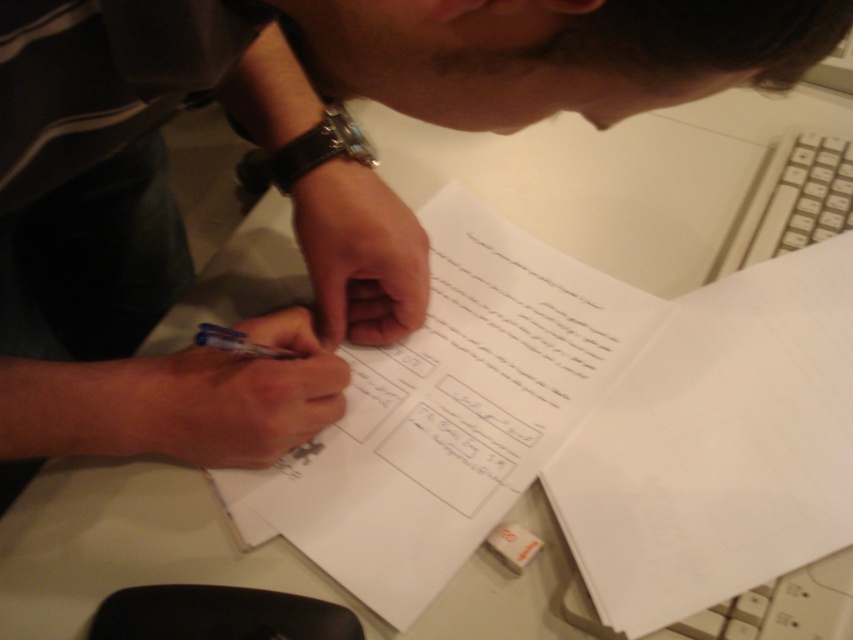
Measure the distance between point [267,451] and camera.

Point [267,451] and camera are 51.11 centimeters apart.

Based on the photo, measure the distance between point (134,212) and camera.

A distance of 30.78 inches exists between point (134,212) and camera.

Find the location of a particular element. This screenshot has width=853, height=640. matte black pen at center is located at coordinates (287, 180).

Between point (845, 156) and point (231, 332), which one is positioned in front?

Positioned in front is point (231, 332).

The height and width of the screenshot is (640, 853). Find the location of `white plastic keyboard at upper right`. white plastic keyboard at upper right is located at coordinates (791, 202).

Who is positioned more to the right, matte black pen at center or white plastic keyboard at upper right?

white plastic keyboard at upper right

Which is above, matte black pen at center or white plastic keyboard at upper right?

white plastic keyboard at upper right is above.

Measure the distance between matte black pen at center and camera.

matte black pen at center is 27.02 centimeters from camera.

Where is `matte black pen at center`? Image resolution: width=853 pixels, height=640 pixels. matte black pen at center is located at coordinates (287, 180).